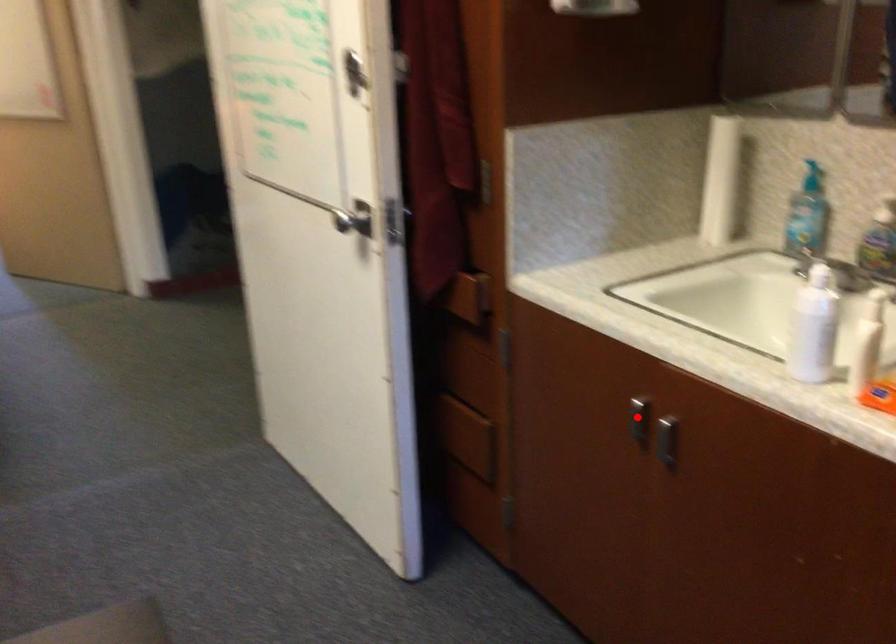
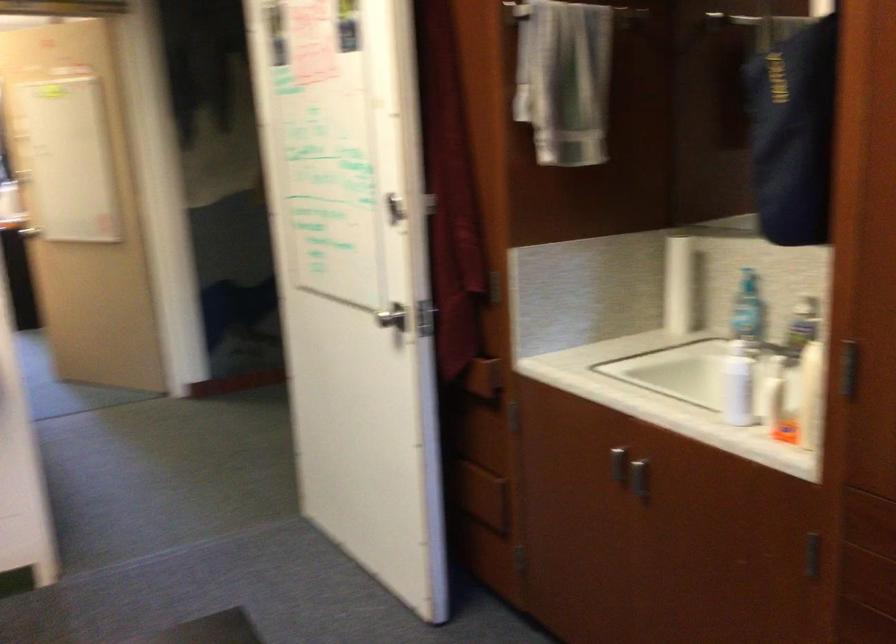
Question: I am providing you with two images of the same scene from different viewpoints. In image1, a red point is highlighted. Considering the same 3D point in image2, which of the following is correct?

Choices:
 (A) It is closer
 (B) It is farther

Answer: (B)